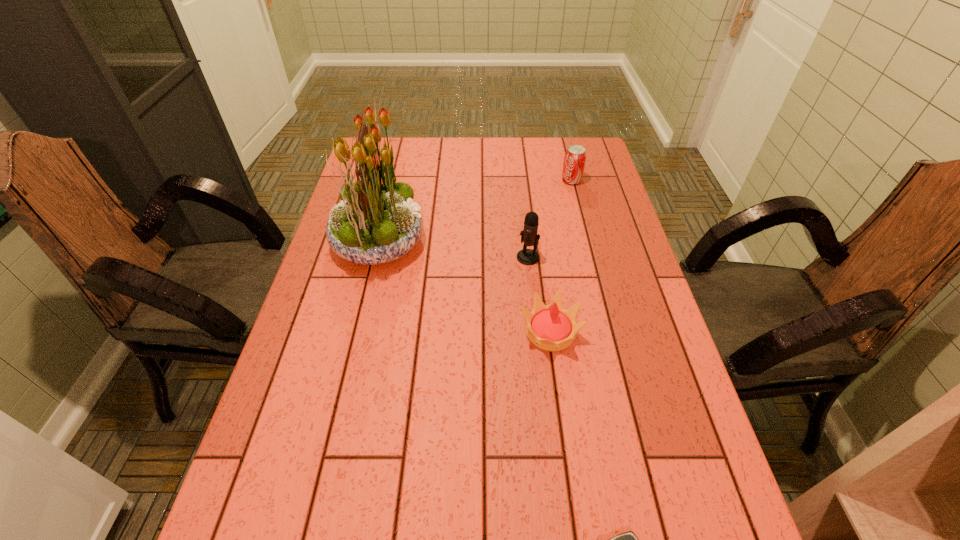
Locate an element on the screen. The width and height of the screenshot is (960, 540). empty space between the second tallest object and the leftmost object is located at coordinates click(453, 249).

The width and height of the screenshot is (960, 540). I want to click on free space between the fourth farthest object and the fourth shortest object, so pos(540,294).

Locate which object is the fourth closest to the second nearest object. Please provide its 2D coordinates. Your answer should be formatted as a tuple, i.e. [(x, y)], where the tuple contains the x and y coordinates of a point satisfying the conditions above.

[(575, 157)]

Point out which object is positioned as the third nearest to the rightmost object. Please provide its 2D coordinates. Your answer should be formatted as a tuple, i.e. [(x, y)], where the tuple contains the x and y coordinates of a point satisfying the conditions above.

[(550, 327)]

Find the location of a particular element. free space that satisfies the following two spatial constraints: 1. on the back side of the fourth farthest object; 2. on the front-facing side of the flower arrangement is located at coordinates (538, 241).

This screenshot has height=540, width=960. Find the location of `free space that satisfies the following two spatial constraints: 1. on the back side of the second nearest object; 2. on the front-facing side of the leftmost object`. free space that satisfies the following two spatial constraints: 1. on the back side of the second nearest object; 2. on the front-facing side of the leftmost object is located at coordinates (538, 241).

Locate an element on the screen. free location that satisfies the following two spatial constraints: 1. on the front-facing side of the flower arrangement; 2. on the back side of the microphone is located at coordinates (375, 257).

The image size is (960, 540). In order to click on free spot that satisfies the following two spatial constraints: 1. on the back side of the second tallest object; 2. on the front-facing side of the flower arrangement in this screenshot , I will do `click(526, 241)`.

Locate an element on the screen. The width and height of the screenshot is (960, 540). free spot that satisfies the following two spatial constraints: 1. on the front-facing side of the microphone; 2. on the left side of the leftmost object is located at coordinates (375, 257).

Identify the location of free point that satisfies the following two spatial constraints: 1. on the back side of the rightmost object; 2. on the right side of the microphone. The height and width of the screenshot is (540, 960). (519, 180).